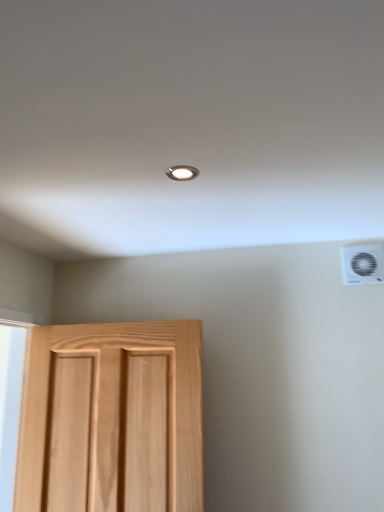
Question: Should I look upward or downward to see white plastic air conditioning unit at upper right?

Choices:
 (A) down
 (B) up

Answer: (A)

Question: Is white plastic air conditioning unit at upper right to the right of natural wood door at lower left from the viewer's perspective?

Choices:
 (A) no
 (B) yes

Answer: (B)

Question: Considering the relative sizes of white plastic air conditioning unit at upper right and natural wood door at lower left in the image provided, is white plastic air conditioning unit at upper right shorter than natural wood door at lower left?

Choices:
 (A) no
 (B) yes

Answer: (B)

Question: Is white plastic air conditioning unit at upper right next to natural wood door at lower left and touching it?

Choices:
 (A) yes
 (B) no

Answer: (B)

Question: From a real-world perspective, is white plastic air conditioning unit at upper right physically below natural wood door at lower left?

Choices:
 (A) yes
 (B) no

Answer: (B)

Question: From the image's perspective, is white plastic air conditioning unit at upper right beneath natural wood door at lower left?

Choices:
 (A) no
 (B) yes

Answer: (A)

Question: Does white plastic air conditioning unit at upper right turn towards natural wood door at lower left?

Choices:
 (A) yes
 (B) no

Answer: (B)

Question: Is natural wood door at lower left positioned far away from white plastic air conditioning unit at upper right?

Choices:
 (A) no
 (B) yes

Answer: (B)

Question: Is natural wood door at lower left taller than white plastic air conditioning unit at upper right?

Choices:
 (A) yes
 (B) no

Answer: (A)

Question: Considering the relative sizes of natural wood door at lower left and white plastic air conditioning unit at upper right in the image provided, is natural wood door at lower left smaller than white plastic air conditioning unit at upper right?

Choices:
 (A) yes
 (B) no

Answer: (B)

Question: Is natural wood door at lower left positioned before white plastic air conditioning unit at upper right?

Choices:
 (A) yes
 (B) no

Answer: (A)

Question: Would you say natural wood door at lower left contains white plastic air conditioning unit at upper right?

Choices:
 (A) yes
 (B) no

Answer: (B)

Question: From the image's perspective, does natural wood door at lower left appear higher than white plastic air conditioning unit at upper right?

Choices:
 (A) yes
 (B) no

Answer: (B)

Question: Based on their sizes in the image, would you say natural wood door at lower left is bigger or smaller than white plastic air conditioning unit at upper right?

Choices:
 (A) small
 (B) big

Answer: (B)